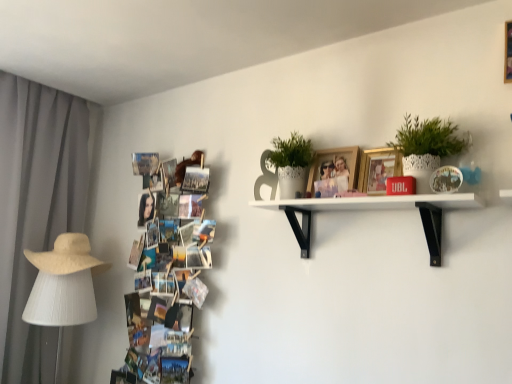
Question: Does beige straw hat at left have a lesser width compared to white textured pot at upper right, acting as the 1th houseplant starting from the right?

Choices:
 (A) yes
 (B) no

Answer: (B)

Question: Does beige straw hat at left have a lesser height compared to white textured pot at upper right, the second houseplant viewed from the left?

Choices:
 (A) yes
 (B) no

Answer: (A)

Question: From the image's perspective, would you say beige straw hat at left is shown under white textured pot at upper right, the first houseplant viewed from the front?

Choices:
 (A) yes
 (B) no

Answer: (A)

Question: Is beige straw hat at left placed right next to white textured pot at upper right, acting as the 1th houseplant starting from the right?

Choices:
 (A) yes
 (B) no

Answer: (B)

Question: From a real-world perspective, is beige straw hat at left located beneath white textured pot at upper right, the second houseplant viewed from the left?

Choices:
 (A) yes
 (B) no

Answer: (A)

Question: Is white fabric lampshade at left situated inside white matte shelf at upper center or outside?

Choices:
 (A) inside
 (B) outside

Answer: (B)

Question: In terms of size, does white fabric lampshade at left appear bigger or smaller than white matte shelf at upper center?

Choices:
 (A) small
 (B) big

Answer: (B)

Question: From a real-world perspective, is white fabric lampshade at left physically located above or below white matte shelf at upper center?

Choices:
 (A) below
 (B) above

Answer: (A)

Question: Considering the positions of point (78, 274) and point (460, 198), is point (78, 274) closer or farther from the camera than point (460, 198)?

Choices:
 (A) closer
 (B) farther

Answer: (B)

Question: Is beige straw hat at left wider or thinner than wooden photo frame at upper center, which is counted as the first picture frame, starting from the left?

Choices:
 (A) thin
 (B) wide

Answer: (B)

Question: Considering their positions, is beige straw hat at left located in front of or behind wooden photo frame at upper center, which appears as the 2th picture frame when viewed from the right?

Choices:
 (A) behind
 (B) front

Answer: (A)

Question: From a real-world perspective, is beige straw hat at left physically located above or below wooden photo frame at upper center, which is counted as the first picture frame, starting from the left?

Choices:
 (A) above
 (B) below

Answer: (B)

Question: Is beige straw hat at left taller or shorter than wooden photo frame at upper center, which appears as the 2th picture frame when viewed from the right?

Choices:
 (A) tall
 (B) short

Answer: (A)

Question: From a real-world perspective, is gray fabric curtain at left above or below white fabric lampshade at left?

Choices:
 (A) below
 (B) above

Answer: (B)

Question: Would you say gray fabric curtain at left is to the left or to the right of white fabric lampshade at left in the picture?

Choices:
 (A) right
 (B) left

Answer: (B)